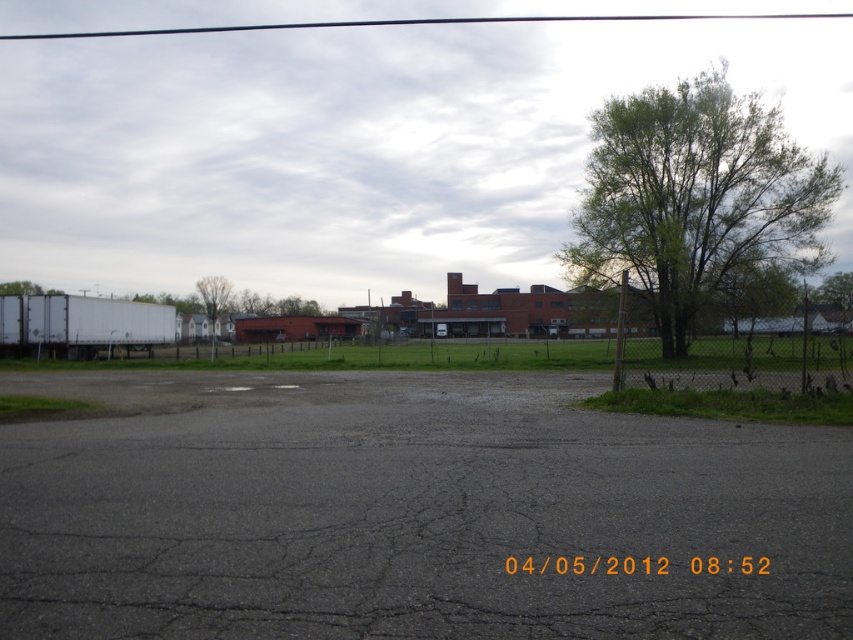
Does metal chain-link fence at right appear over green leafy tree at center?

Actually, metal chain-link fence at right is below green leafy tree at center.

Which is behind, point (631, 328) or point (231, 284)?

Positioned behind is point (231, 284).

This screenshot has height=640, width=853. I want to click on metal chain-link fence at right, so click(x=740, y=355).

Identify the location of green leafy tree at right. (695, 196).

Who is taller, green leafy tree at right or metal chain-link fence at right?

green leafy tree at right is taller.

Is point (646, 209) closer to camera compared to point (819, 340)?

That is False.

This screenshot has height=640, width=853. Identify the location of green leafy tree at right. pyautogui.click(x=695, y=196).

The height and width of the screenshot is (640, 853). What are the coordinates of `green leafy tree at right` in the screenshot? It's located at (695, 196).

Is point (602, 147) positioned in front of point (222, 300)?

Yes, point (602, 147) is in front of point (222, 300).

Find the location of a particular element. This screenshot has width=853, height=640. green leafy tree at right is located at coordinates (695, 196).